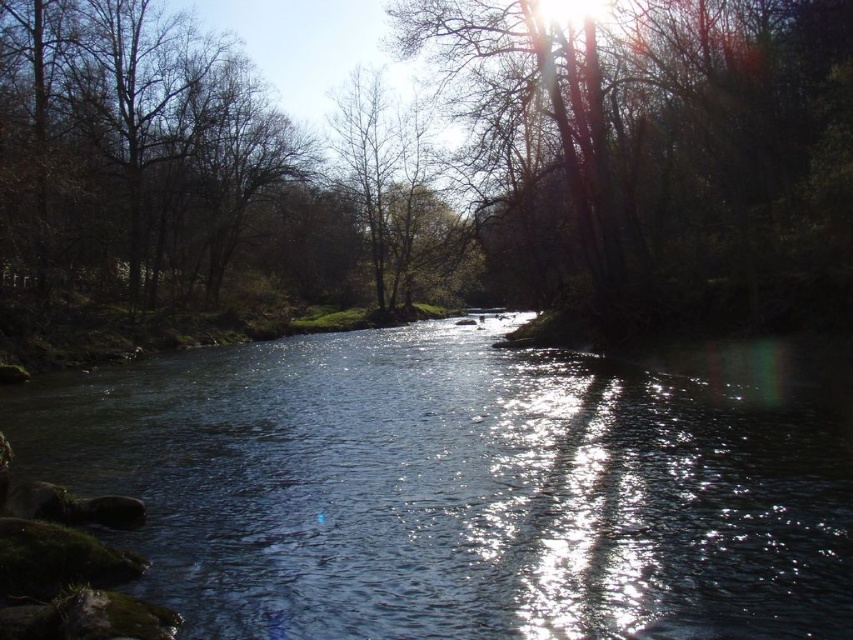
You are standing at the point where the coordinates are [468,486]. What is the type of water you are currently standing on?

The clear water at center is located at point [468,486], so you are standing on clear water at center.

Consider the image. You are standing at the edge of the river and want to place a small boat between the two points, point (x=672, y=90) and point (x=88, y=257). Which point is closer to you so that you can safely anchor the boat there?

Point (x=672, y=90) is closer to the viewer than point (x=88, y=257), so you can safely anchor the boat there.